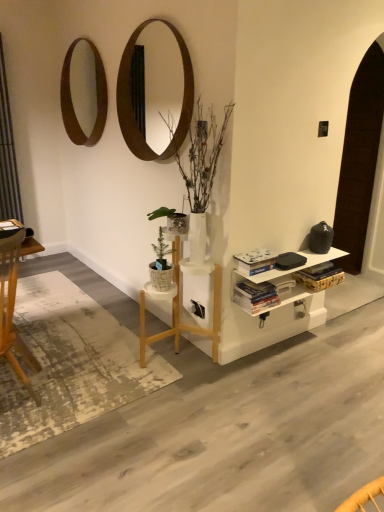
Where is `wooden desk at left`? This screenshot has height=512, width=384. wooden desk at left is located at coordinates (30, 244).

At what (x,y) coordinates should I click in order to perform the action: click on white painted wood shelf at lower right. Please return your answer as a coordinate pair (x, y). Looking at the image, I should click on (286, 271).

What is the approximate height of wooden circular mirror at upper left, the 2th mirror when ordered from right to left?

It is 83.59 centimeters.

This screenshot has height=512, width=384. What do you see at coordinates (201, 155) in the screenshot?
I see `green leafy plant at center` at bounding box center [201, 155].

Describe the element at coordinates (255, 296) in the screenshot. I see `hardcover books at center, placed as the first book when sorted from bottom to top` at that location.

What do you see at coordinates (7, 154) in the screenshot? This screenshot has height=512, width=384. I see `metallic gray curtain at left` at bounding box center [7, 154].

Find the location of a particular element. wooden desk at left is located at coordinates (30, 244).

Is point (68, 105) positioned behind point (237, 295)?

Yes, it is.

Is wooden circular mirror at upper left, which is the first mirror in back-to-front order, facing away from hardcover books at center, placed as the first book when sorted from bottom to top?

No, wooden circular mirror at upper left, which is the first mirror in back-to-front order, is not facing the opposite direction of hardcover books at center, placed as the first book when sorted from bottom to top.

Which of these two, wooden circular mirror at upper left, the 2th mirror when ordered from right to left, or hardcover books at center, the second book positioned from the top, is smaller?

With smaller size is hardcover books at center, the second book positioned from the top.

Which object is positioned more to the right, wooden circular mirror at upper left, which is the first mirror in back-to-front order, or hardcover books at center, placed as the first book when sorted from bottom to top?

Positioned to the right is hardcover books at center, placed as the first book when sorted from bottom to top.

From a real-world perspective, is wooden desk at left located beneath green leafy plant at center?

Indeed, from a real-world perspective, wooden desk at left is positioned beneath green leafy plant at center.

Is there a large distance between wooden desk at left and green leafy plant at center?

Actually, wooden desk at left and green leafy plant at center are a little close together.

Considering the relative sizes of wooden desk at left and green leafy plant at center in the image provided, is wooden desk at left bigger than green leafy plant at center?

No, wooden desk at left is not bigger than green leafy plant at center.

Would you say wooden desk at left contains green leafy plant at center?

No, green leafy plant at center is not a part of wooden desk at left.

The image size is (384, 512). Identify the location of desk that is on the left side of hardcover book at center, the second book positioned from the bottom. (30, 244).

Which object is further away from the camera taking this photo, hardcover book at center, acting as the 1th book starting from the top, or wooden desk at left?

Positioned behind is hardcover book at center, acting as the 1th book starting from the top.

Could you measure the distance between hardcover book at center, the second book positioned from the bottom, and wooden desk at left?

1.15 meters.

From the picture: Is hardcover book at center, the second book positioned from the bottom, facing towards wooden desk at left?

No, hardcover book at center, the second book positioned from the bottom, is not aimed at wooden desk at left.

Considering the sizes of objects wooden desk at left and hardcover book at center, the second book positioned from the bottom, in the image provided, who is thinner, wooden desk at left or hardcover book at center, the second book positioned from the bottom,?

Thinner between the two is hardcover book at center, the second book positioned from the bottom.

Does wooden desk at left appear on the right side of hardcover book at center, the second book positioned from the bottom?

In fact, wooden desk at left is to the left of hardcover book at center, the second book positioned from the bottom.

From a real-world perspective, is wooden desk at left on hardcover book at center, the second book positioned from the bottom?

Indeed, from a real-world perspective, wooden desk at left stands above hardcover book at center, the second book positioned from the bottom.

Can you see wooden desk at left touching hardcover book at center, acting as the 1th book starting from the top?

No, wooden desk at left is not in contact with hardcover book at center, acting as the 1th book starting from the top.

Looking at the image, does wooden mirror at upper center, which is the first mirror in front-to-back order, seem bigger or smaller compared to wooden desk at left?

In the image, wooden mirror at upper center, which is the first mirror in front-to-back order, appears to be larger than wooden desk at left.

Where is `desk located behind the wooden mirror at upper center, placed as the second mirror when sorted from back to front`? This screenshot has width=384, height=512. desk located behind the wooden mirror at upper center, placed as the second mirror when sorted from back to front is located at coordinates (30, 244).

Considering the sizes of objects wooden mirror at upper center, acting as the first mirror starting from the right, and wooden desk at left in the image provided, who is taller, wooden mirror at upper center, acting as the first mirror starting from the right, or wooden desk at left?

wooden mirror at upper center, acting as the first mirror starting from the right, is taller.

Between wooden mirror at upper center, placed as the second mirror when sorted from back to front, and wooden desk at left, which one appears on the left side from the viewer's perspective?

Positioned to the left is wooden desk at left.

This screenshot has width=384, height=512. I want to click on table in front of the hardcover books at center, placed as the first book when sorted from bottom to top, so (180, 307).

Considering the sizes of white wood table at center and hardcover books at center, placed as the first book when sorted from bottom to top, in the image, is white wood table at center taller or shorter than hardcover books at center, placed as the first book when sorted from bottom to top,?

Clearly, white wood table at center is taller compared to hardcover books at center, placed as the first book when sorted from bottom to top.

From the image's perspective, which is above, white wood table at center or hardcover books at center, placed as the first book when sorted from bottom to top?

From the image's view, hardcover books at center, placed as the first book when sorted from bottom to top, is above.

From a real-world perspective, is white wood table at center physically below hardcover books at center, placed as the first book when sorted from bottom to top?

Indeed, from a real-world perspective, white wood table at center is positioned beneath hardcover books at center, placed as the first book when sorted from bottom to top.

Identify the location of the 1st mirror counting from the left side of the hardcover books at center, the second book positioned from the top. This screenshot has height=512, width=384. (159, 83).

From the image's perspective, would you say wooden mirror at upper center, placed as the second mirror when sorted from back to front, is positioned over hardcover books at center, the second book positioned from the top?

Yes, from the image's perspective, wooden mirror at upper center, placed as the second mirror when sorted from back to front, is over hardcover books at center, the second book positioned from the top.

Could you tell me if wooden mirror at upper center, placed as the second mirror when sorted from back to front, is turned towards hardcover books at center, placed as the first book when sorted from bottom to top?

No, wooden mirror at upper center, placed as the second mirror when sorted from back to front, is not aimed at hardcover books at center, placed as the first book when sorted from bottom to top.

Does wooden mirror at upper center, which is the first mirror in front-to-back order, touch hardcover books at center, the second book positioned from the top?

They are not placed beside each other.

At what (x,y) coordinates should I click in order to perform the action: click on the 2nd mirror positioned above the hardcover books at center, placed as the first book when sorted from bottom to top (from the image's perspective). Please return your answer as a coordinate pair (x, y). Looking at the image, I should click on (72, 102).

Locate an element on the screen. houseplant on the right of wooden desk at left is located at coordinates (201, 155).

Looking at the image, which one is located further to hardcover books at center, placed as the first book when sorted from bottom to top, green leafy plant at center or wooden desk at left?

wooden desk at left is positioned further to the anchor hardcover books at center, placed as the first book when sorted from bottom to top.

When comparing their distances from wooden desk at left, does wooden circular mirror at upper left, which is the first mirror in back-to-front order, or metallic gray curtain at left seem closer?

wooden circular mirror at upper left, which is the first mirror in back-to-front order, is positioned closer to the anchor wooden desk at left.

From the image, which object appears to be farther from hardcover book at center, acting as the 1th book starting from the top, metallic gray curtain at left or wooden desk at left?

The object further to hardcover book at center, acting as the 1th book starting from the top, is metallic gray curtain at left.

From the image, which object appears to be nearer to wooden circular mirror at upper left, the 2th mirror when ordered from right to left, metallic gray curtain at left or wooden mirror at upper center, which ranks as the 2th mirror in left-to-right order?

wooden mirror at upper center, which ranks as the 2th mirror in left-to-right order, lies closer to wooden circular mirror at upper left, the 2th mirror when ordered from right to left, than the other object.

Looking at the image, which one is located further to white painted wood shelf at lower right, wooden mirror at upper center, placed as the second mirror when sorted from back to front, or wooden circular mirror at upper left, which is the first mirror in back-to-front order?

Based on the image, wooden mirror at upper center, placed as the second mirror when sorted from back to front, appears to be further to white painted wood shelf at lower right.

Considering their positions, is white painted wood shelf at lower right positioned closer to white wood table at center than wooden circular mirror at upper left, which is the 1th mirror from left to right?

white painted wood shelf at lower right lies closer to white wood table at center than the other object.

Based on their spatial positions, is green leafy plant at center or wooden circular mirror at upper left, the 2th mirror positioned from the front, closer to white painted wood shelf at lower right?

Among the two, green leafy plant at center is located nearer to white painted wood shelf at lower right.

Looking at the image, which one is located closer to hardcover books at center, the second book positioned from the top, wooden desk at left or white wood table at center?

The object closer to hardcover books at center, the second book positioned from the top, is white wood table at center.

Locate an element on the screen. The width and height of the screenshot is (384, 512). houseplant between wooden mirror at upper center, placed as the second mirror when sorted from back to front, and hardcover book at center, acting as the 1th book starting from the top, vertically is located at coordinates (201, 155).

Where is `desk located between metallic gray curtain at left and white wood table at center in the left-right direction`? The width and height of the screenshot is (384, 512). desk located between metallic gray curtain at left and white wood table at center in the left-right direction is located at coordinates (30, 244).

You are a GUI agent. You are given a task and a screenshot of the screen. Output one action in this format:
    pyautogui.click(x=<x>, y=<y>)
    Task: Click on the table between wooden desk at left and hardcover book at center, the second book positioned from the bottom
    
    Given the screenshot: What is the action you would take?
    pyautogui.click(x=180, y=307)

You are a GUI agent. You are given a task and a screenshot of the screen. Output one action in this format:
    pyautogui.click(x=<x>, y=<y>)
    Task: Click on the houseplant between wooden desk at left and hardcover book at center, the second book positioned from the bottom, in the horizontal direction
    The image size is (384, 512).
    Given the screenshot: What is the action you would take?
    pyautogui.click(x=201, y=155)